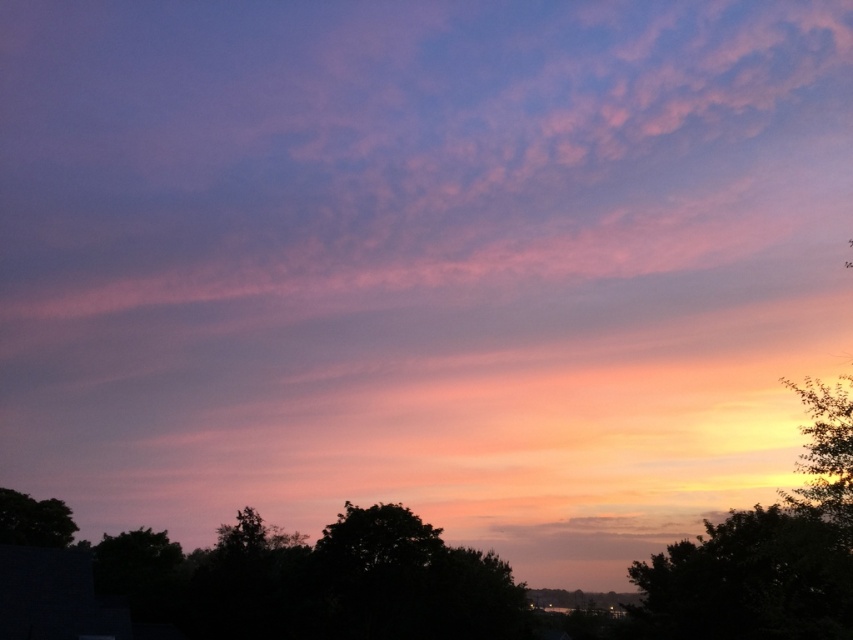
Can you confirm if green leafy tree at right is positioned to the right of green leafy tree at lower left?

Indeed, green leafy tree at right is positioned on the right side of green leafy tree at lower left.

Looking at this image, is green leafy tree at right wider than green leafy tree at lower left?

Yes, green leafy tree at right is wider than green leafy tree at lower left.

Which is behind, point (846, 493) or point (44, 544)?

The point (44, 544) is behind.

The width and height of the screenshot is (853, 640). Find the location of `green leafy tree at right`. green leafy tree at right is located at coordinates (825, 452).

Does green leafy tree at lower right have a smaller size compared to green leafy tree at lower left?

Incorrect, green leafy tree at lower right is not smaller in size than green leafy tree at lower left.

Which is behind, point (785, 595) or point (30, 532)?

The point (30, 532) is behind.

Between point (703, 570) and point (25, 531), which one is positioned behind?

Positioned behind is point (25, 531).

The width and height of the screenshot is (853, 640). I want to click on green leafy tree at lower right, so click(749, 580).

Does green leafy tree at lower right have a greater height compared to green leafy tree at right?

Incorrect, green leafy tree at lower right's height is not larger of green leafy tree at right's.

Is green leafy tree at lower right bigger than green leafy tree at right?

Incorrect, green leafy tree at lower right is not larger than green leafy tree at right.

Locate an element on the screen. The width and height of the screenshot is (853, 640). green leafy tree at lower right is located at coordinates (749, 580).

You are a GUI agent. You are given a task and a screenshot of the screen. Output one action in this format:
    pyautogui.click(x=<x>, y=<y>)
    Task: Click on the green leafy tree at lower right
    The height and width of the screenshot is (640, 853).
    Given the screenshot: What is the action you would take?
    pyautogui.click(x=749, y=580)